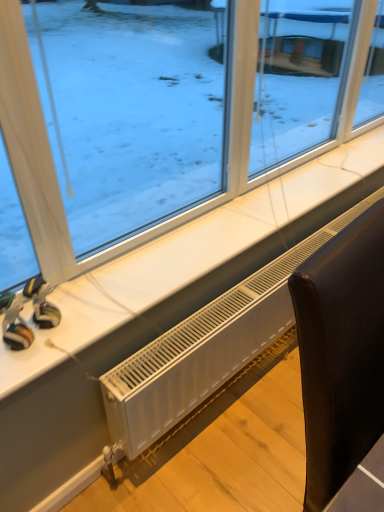
What is the approximate height of transparent glass window at upper center?

transparent glass window at upper center is 72.11 centimeters in height.

Identify the location of black leather chair at lower right. (341, 352).

This screenshot has height=512, width=384. What are the coordinates of `matte plastic toy at lower left, the 2th toy viewed from the left` in the screenshot? It's located at (42, 302).

In terms of height, does white plastic radiator at lower center look taller or shorter compared to matte plastic toy at lower left, acting as the 1th toy starting from the right?

In the image, white plastic radiator at lower center appears to be taller than matte plastic toy at lower left, acting as the 1th toy starting from the right.

Is white plastic radiator at lower center oriented towards matte plastic toy at lower left, the 2th toy viewed from the left?

No, white plastic radiator at lower center does not turn towards matte plastic toy at lower left, the 2th toy viewed from the left.

Could you measure the distance between white plastic radiator at lower center and matte plastic toy at lower left, the 2th toy viewed from the left?

white plastic radiator at lower center and matte plastic toy at lower left, the 2th toy viewed from the left, are 21.01 inches apart.

Consider the image. Considering the positions of objects transparent glass window at upper center and white plastic radiator at lower center in the image provided, who is more to the left, transparent glass window at upper center or white plastic radiator at lower center?

transparent glass window at upper center is more to the left.

I want to click on window that is in front of the white plastic radiator at lower center, so click(x=165, y=114).

Which is less distant, (x=229, y=81) or (x=135, y=445)?

Point (x=229, y=81).

Who is bigger, transparent glass window at upper center or white plastic radiator at lower center?

With larger size is transparent glass window at upper center.

Is point (60, 316) closer or farther from the camera than point (326, 455)?

Point (60, 316) is positioned farther from the camera compared to point (326, 455).

Where is `the 1st toy to the left when counting from the black leather chair at lower right`? This screenshot has height=512, width=384. the 1st toy to the left when counting from the black leather chair at lower right is located at coordinates (42, 302).

Would you say matte plastic toy at lower left, the 2th toy viewed from the left, is inside or outside black leather chair at lower right?

matte plastic toy at lower left, the 2th toy viewed from the left, lies outside black leather chair at lower right.

Considering the positions of objects matte plastic toy at lower left, the 2th toy viewed from the left, and black leather chair at lower right in the image provided, who is more to the left, matte plastic toy at lower left, the 2th toy viewed from the left, or black leather chair at lower right?

matte plastic toy at lower left, the 2th toy viewed from the left, is more to the left.

Is the position of rubberized plastic toy at lower left, which is counted as the 1th toy, starting from the left, more distant than that of black leather chair at lower right?

Yes, it is.

Who is shorter, rubberized plastic toy at lower left, which is counted as the 1th toy, starting from the left, or black leather chair at lower right?

With less height is rubberized plastic toy at lower left, which is counted as the 1th toy, starting from the left.

Can you confirm if rubberized plastic toy at lower left, the second toy in the right-to-left sequence, is thinner than black leather chair at lower right?

Yes, rubberized plastic toy at lower left, the second toy in the right-to-left sequence, is thinner than black leather chair at lower right.

Is rubberized plastic toy at lower left, which is counted as the 1th toy, starting from the left, next to black leather chair at lower right?

They are not placed beside each other.

Is rubberized plastic toy at lower left, which is counted as the 1th toy, starting from the left, bigger than white plastic radiator at lower center?

No, rubberized plastic toy at lower left, which is counted as the 1th toy, starting from the left, is not bigger than white plastic radiator at lower center.

You are a GUI agent. You are given a task and a screenshot of the screen. Output one action in this format:
    pyautogui.click(x=<x>, y=<y>)
    Task: Click on the toy that is the 2nd one above the white plastic radiator at lower center (from a real-world perspective)
    The image size is (384, 512).
    Given the screenshot: What is the action you would take?
    (x=15, y=322)

Is rubberized plastic toy at lower left, which is counted as the 1th toy, starting from the left, facing towards white plastic radiator at lower center?

No, rubberized plastic toy at lower left, which is counted as the 1th toy, starting from the left, is not aimed at white plastic radiator at lower center.

Who is taller, black leather chair at lower right or transparent glass window at upper center?

Standing taller between the two is black leather chair at lower right.

Which object is positioned more to the left, black leather chair at lower right or transparent glass window at upper center?

transparent glass window at upper center.

Consider the image. Relative to transparent glass window at upper center, is black leather chair at lower right in front or behind?

In the image, black leather chair at lower right appears in front of transparent glass window at upper center.

From the image's perspective, which one is positioned lower, black leather chair at lower right or transparent glass window at upper center?

black leather chair at lower right, from the image's perspective.

Between point (106, 217) and point (359, 298), which one is positioned in front?

The point (359, 298) is in front.

This screenshot has height=512, width=384. I want to click on furniture on the right of transparent glass window at upper center, so click(x=341, y=352).

Is transparent glass window at upper center looking in the opposite direction of black leather chair at lower right?

No, transparent glass window at upper center's orientation is not away from black leather chair at lower right.

Can you confirm if transparent glass window at upper center is shorter than black leather chair at lower right?

Yes, transparent glass window at upper center is shorter than black leather chair at lower right.

Locate an element on the screen. This screenshot has height=512, width=384. air conditioning on the right of matte plastic toy at lower left, acting as the 1th toy starting from the right is located at coordinates (206, 347).

The width and height of the screenshot is (384, 512). What are the coordinates of `window above the white plastic radiator at lower center (from a real-world perspective)` in the screenshot? It's located at (165, 114).

Which object lies further to the anchor point black leather chair at lower right, matte plastic toy at lower left, the 2th toy viewed from the left, or rubberized plastic toy at lower left, which is counted as the 1th toy, starting from the left?

rubberized plastic toy at lower left, which is counted as the 1th toy, starting from the left.

Looking at the image, which one is located further to white plastic radiator at lower center, black leather chair at lower right or rubberized plastic toy at lower left, the second toy in the right-to-left sequence?

rubberized plastic toy at lower left, the second toy in the right-to-left sequence, lies further to white plastic radiator at lower center than the other object.

Estimate the real-world distances between objects in this image. Which object is further from matte plastic toy at lower left, the 2th toy viewed from the left, transparent glass window at upper center or black leather chair at lower right?

black leather chair at lower right lies further to matte plastic toy at lower left, the 2th toy viewed from the left, than the other object.

When comparing their distances from transparent glass window at upper center, does rubberized plastic toy at lower left, the second toy in the right-to-left sequence, or matte plastic toy at lower left, the 2th toy viewed from the left, seem further?

rubberized plastic toy at lower left, the second toy in the right-to-left sequence, is positioned further to the anchor transparent glass window at upper center.

When comparing their distances from transparent glass window at upper center, does white plastic radiator at lower center or matte plastic toy at lower left, the 2th toy viewed from the left, seem closer?

white plastic radiator at lower center lies closer to transparent glass window at upper center than the other object.

Consider the image. From the image, which object appears to be nearer to matte plastic toy at lower left, the 2th toy viewed from the left, black leather chair at lower right or transparent glass window at upper center?

transparent glass window at upper center.

From the image, which object appears to be nearer to rubberized plastic toy at lower left, the second toy in the right-to-left sequence, transparent glass window at upper center or matte plastic toy at lower left, the 2th toy viewed from the left?

matte plastic toy at lower left, the 2th toy viewed from the left.

Which object lies further to the anchor point white plastic radiator at lower center, rubberized plastic toy at lower left, which is counted as the 1th toy, starting from the left, or matte plastic toy at lower left, the 2th toy viewed from the left?

rubberized plastic toy at lower left, which is counted as the 1th toy, starting from the left, is further to white plastic radiator at lower center.

I want to click on toy between rubberized plastic toy at lower left, the second toy in the right-to-left sequence, and black leather chair at lower right from left to right, so click(42, 302).

Where is `air conditioning located between rubberized plastic toy at lower left, the second toy in the right-to-left sequence, and black leather chair at lower right in the left-right direction`? This screenshot has height=512, width=384. air conditioning located between rubberized plastic toy at lower left, the second toy in the right-to-left sequence, and black leather chair at lower right in the left-right direction is located at coordinates (206, 347).

Find the location of a particular element. This screenshot has height=512, width=384. toy between transparent glass window at upper center and rubberized plastic toy at lower left, which is counted as the 1th toy, starting from the left, in the vertical direction is located at coordinates [x=42, y=302].

Identify the location of air conditioning between matte plastic toy at lower left, acting as the 1th toy starting from the right, and black leather chair at lower right. (206, 347).